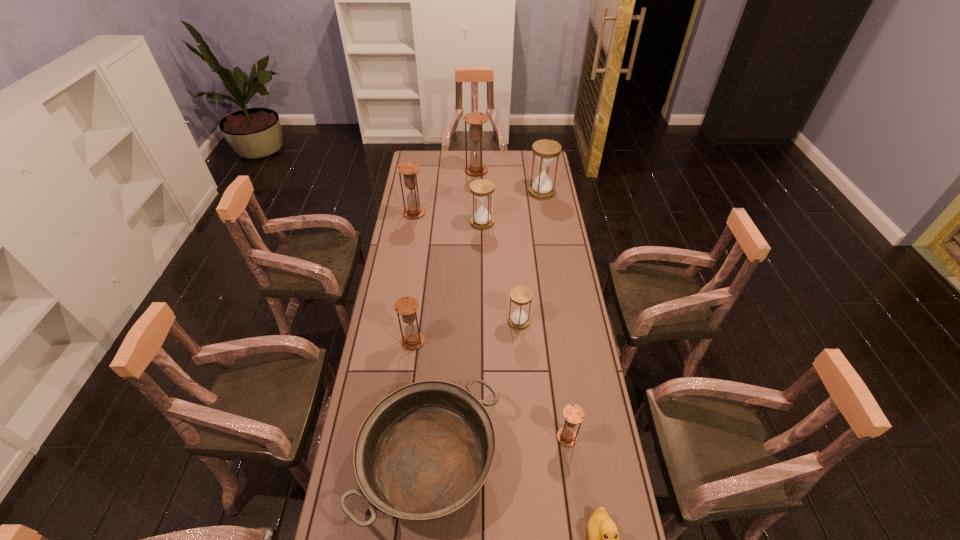
Identify which hourglass is the closest to the second farthest brown hourglass. Please provide its 2D coordinates. Your answer should be formatted as a tuple, i.e. [(x, y)], where the tuple contains the x and y coordinates of a point satisfying the conditions above.

[(481, 189)]

Where is `hourglass that is the second closest to the second biggest brown hourglass`? The width and height of the screenshot is (960, 540). hourglass that is the second closest to the second biggest brown hourglass is located at coordinates (x=475, y=120).

Locate which brown hourglass is the closest to the pan. Please provide its 2D coordinates. Your answer should be formatted as a tuple, i.e. [(x, y)], where the tuple contains the x and y coordinates of a point satisfying the conditions above.

[(574, 414)]

Identify which brown hourglass is located as the fourth nearest to the pan. Please provide its 2D coordinates. Your answer should be formatted as a tuple, i.e. [(x, y)], where the tuple contains the x and y coordinates of a point satisfying the conditions above.

[(475, 120)]

I want to click on the closest white hourglass relative to the second smallest brown hourglass, so click(x=520, y=295).

Point out which white hourglass is positioned as the nearest to the second farthest white hourglass. Please provide its 2D coordinates. Your answer should be formatted as a tuple, i.e. [(x, y)], where the tuple contains the x and y coordinates of a point satisfying the conditions above.

[(546, 151)]

At what (x,y) coordinates should I click in order to perform the action: click on vacant region that satisfies the following two spatial constraints: 1. on the front side of the nearest white hourglass; 2. on the right side of the second smallest white hourglass. Please return your answer as a coordinate pair (x, y). The width and height of the screenshot is (960, 540). Looking at the image, I should click on (483, 321).

You are a GUI agent. You are given a task and a screenshot of the screen. Output one action in this format:
    pyautogui.click(x=<x>, y=<y>)
    Task: Click on the vacant area in the image that satisfies the following two spatial constraints: 1. on the back side of the smallest white hourglass; 2. on the left side of the farthest white hourglass
    
    Given the screenshot: What is the action you would take?
    pyautogui.click(x=509, y=192)